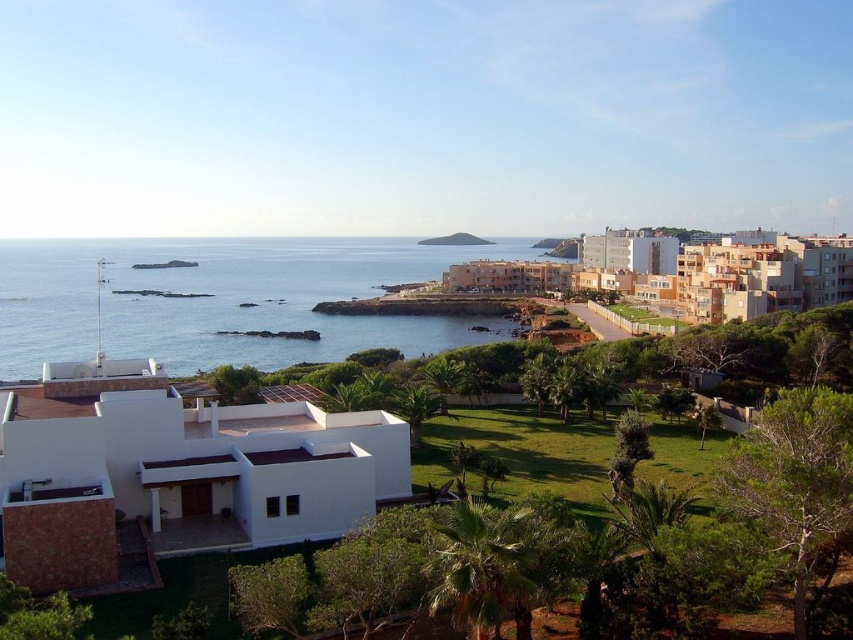
You are standing on the green grassy hillside at center and want to reach the blue water at lower left. Which direction should you move to get there?

To reach the blue water at lower left from the green grassy hillside at center, you should move downward since the blue water at lower left is located below the green grassy hillside at center.

You are standing at the center of the image. Which direction should you walk to reach the blue water at lower left?

The blue water at lower left is located at coordinates 0.469 on the x axis and 0.264 on the y axis, so you should walk towards the lower left direction to reach it.